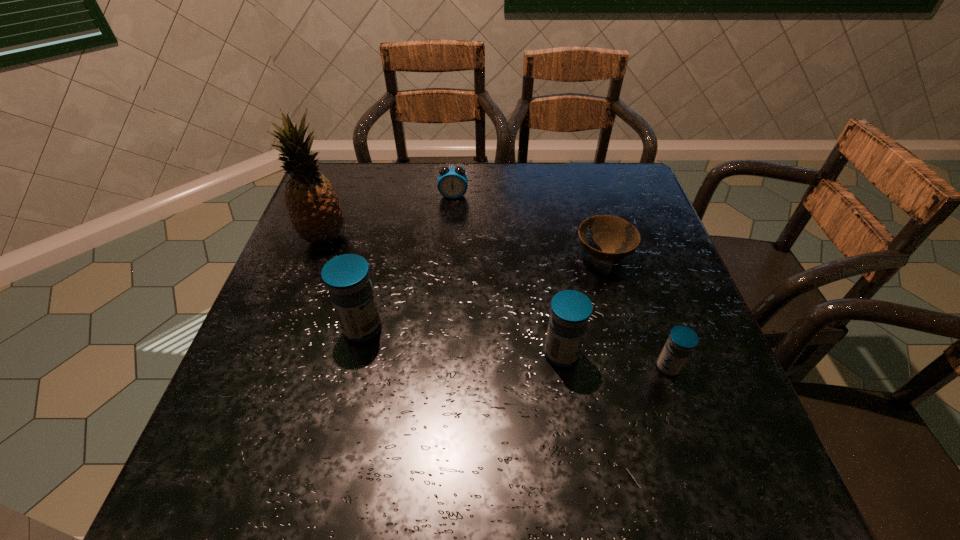
Identify the location of the second object from left to right. The width and height of the screenshot is (960, 540). (347, 277).

This screenshot has height=540, width=960. What are the coordinates of `the second tallest medicine` in the screenshot? It's located at (570, 310).

Find the location of `the second medicine from left to right`. the second medicine from left to right is located at coordinates (570, 310).

Locate an element on the screen. This screenshot has height=540, width=960. the shortest medicine is located at coordinates (682, 340).

At what (x,y) coordinates should I click in order to perform the action: click on the farthest object. Please return your answer as a coordinate pair (x, y). Looking at the image, I should click on (452, 183).

Where is `alarm clock`? Image resolution: width=960 pixels, height=540 pixels. alarm clock is located at coordinates (452, 183).

Where is `bowl`? The height and width of the screenshot is (540, 960). bowl is located at coordinates (617, 238).

You are a GUI agent. You are given a task and a screenshot of the screen. Output one action in this format:
    pyautogui.click(x=<x>, y=<y>)
    Task: Click on the tallest object
    
    Given the screenshot: What is the action you would take?
    pyautogui.click(x=313, y=206)

Where is `the leftmost object`? The width and height of the screenshot is (960, 540). the leftmost object is located at coordinates (313, 206).

Where is `vacant area situated 0.180m on the front of the leftmost medicine`? vacant area situated 0.180m on the front of the leftmost medicine is located at coordinates (339, 429).